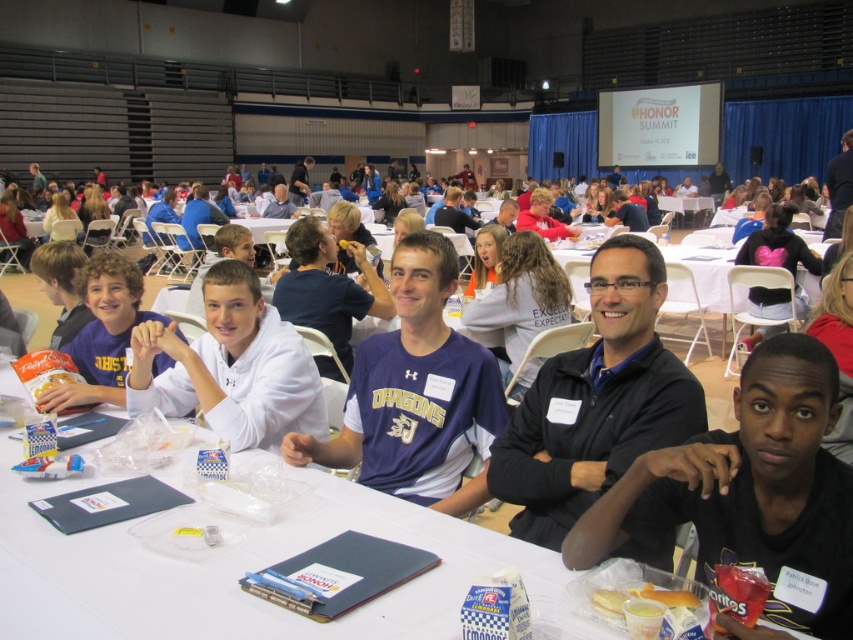
Question: Which point is closer to the camera?

Choices:
 (A) white matte shirt at center
 (B) purple jersey at center
 (C) black matte shirt at lower right
 (D) white paper plate at center

Answer: (C)

Question: Does black matte jacket at center have a lesser width compared to yellow paper cupcake at lower center?

Choices:
 (A) yes
 (B) no

Answer: (B)

Question: Is white paper plate at center wider than purple jersey at center?

Choices:
 (A) yes
 (B) no

Answer: (A)

Question: Does black matte jacket at center lie behind yellow paper cupcake at lower center?

Choices:
 (A) yes
 (B) no

Answer: (A)

Question: Which object is the farthest from the black matte jacket at center?

Choices:
 (A) matte white shirt at center
 (B) purple jersey at center
 (C) white paper plate at center
 (D) black matte shirt at lower right

Answer: (A)

Question: Which of the following is the closest to the observer?

Choices:
 (A) matte white shirt at center
 (B) black matte shirt at lower right
 (C) black matte jacket at center

Answer: (B)